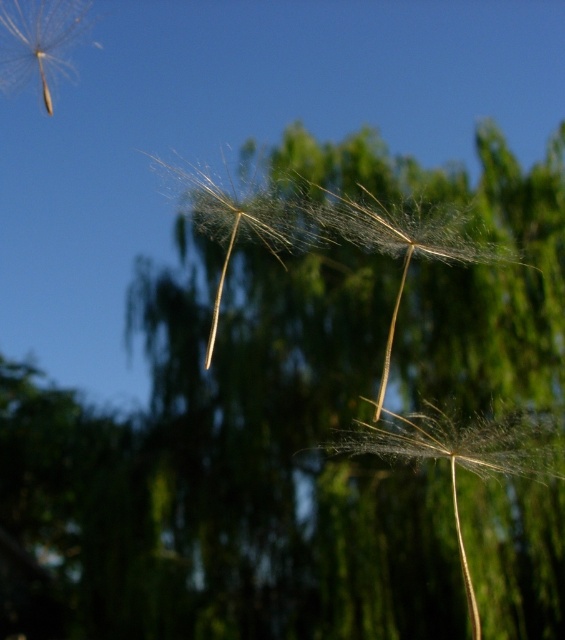
Question: Does translucent paper dandelion at center come behind translucent white dandelion at center?

Choices:
 (A) yes
 (B) no

Answer: (B)

Question: Among these objects, which one is nearest to the camera?

Choices:
 (A) translucent paper dandelion at center
 (B) translucent white dandelion at center
 (C) translucent fibrous dandelion at center
 (D) transparent white dandelion at upper left

Answer: (C)

Question: Which object is the farthest from the transparent white dandelion at upper left?

Choices:
 (A) translucent fibrous dandelion at center
 (B) translucent white dandelion at center

Answer: (A)

Question: Is translucent fibrous dandelion at center further to the viewer compared to translucent paper dandelion at center?

Choices:
 (A) yes
 (B) no

Answer: (B)

Question: Among these points, which one is farthest from the camera?

Choices:
 (A) (53, 36)
 (B) (182, 182)

Answer: (A)

Question: Can you confirm if translucent white dandelion at center is positioned to the left of transparent white dandelion at upper left?

Choices:
 (A) yes
 (B) no

Answer: (B)